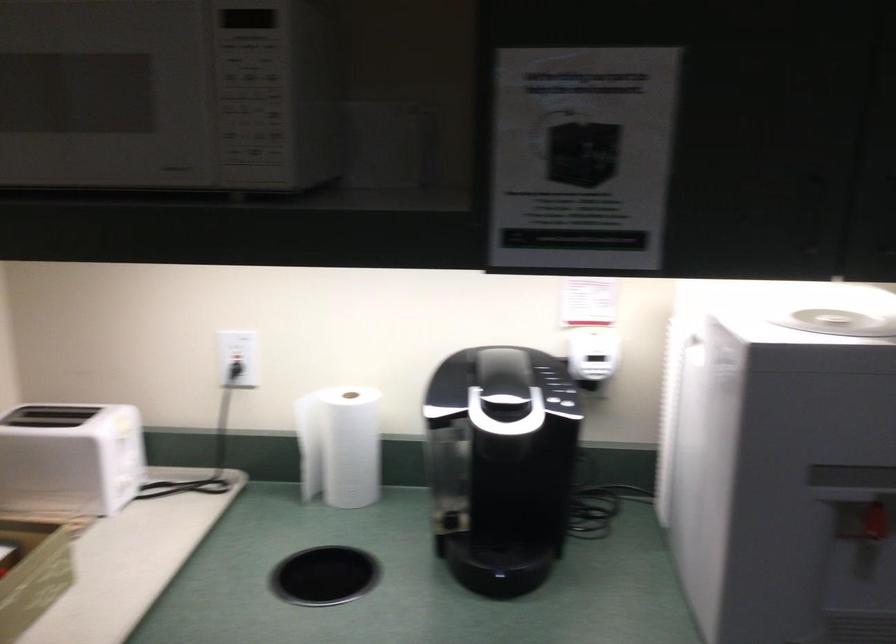
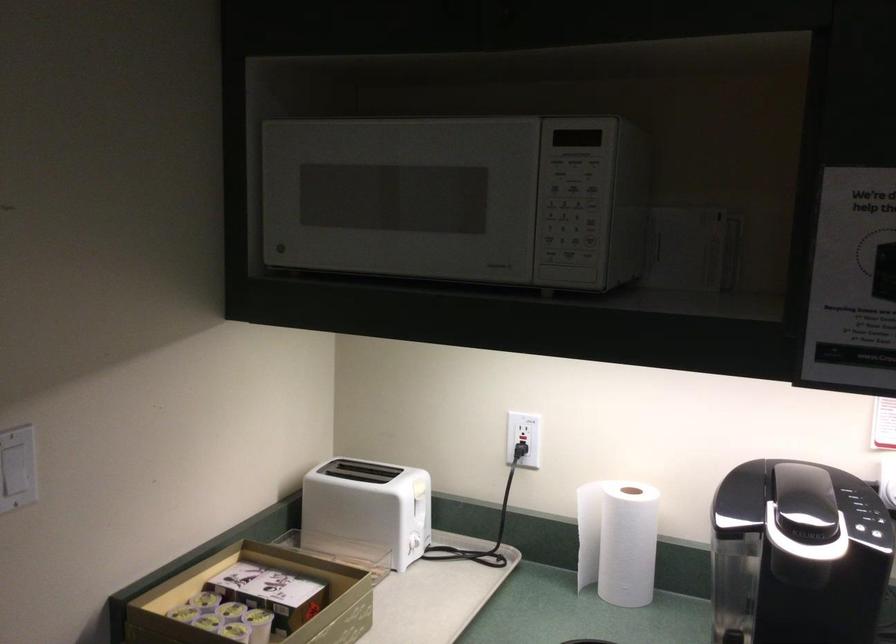
In the second image, find the point that corresponds to point 233,375 in the first image.

(521, 456)